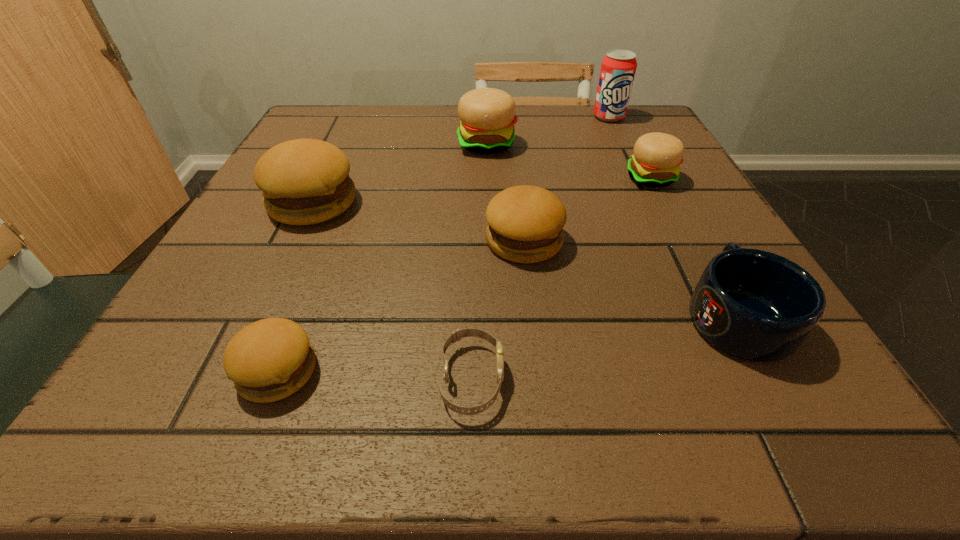
Where is `vacant space situated on the right of the shortest hamburger`? vacant space situated on the right of the shortest hamburger is located at coordinates (563, 371).

Where is `free space located on the face of the watch`? free space located on the face of the watch is located at coordinates (648, 380).

I want to click on soda can at the far edge, so click(618, 68).

I want to click on hamburger located at the far edge, so click(487, 115).

Find the location of `mug that is at the near edge`. mug that is at the near edge is located at coordinates (755, 305).

What are the coordinates of `hamburger that is at the near edge` in the screenshot? It's located at (268, 360).

Where is `watch present at the near edge`? The image size is (960, 540). watch present at the near edge is located at coordinates (469, 332).

The height and width of the screenshot is (540, 960). Find the location of `soda can positioned at the right edge`. soda can positioned at the right edge is located at coordinates pos(618,68).

I want to click on hamburger located in the right edge section of the desktop, so click(656, 161).

At what (x,y) coordinates should I click in order to perform the action: click on mug located in the right edge section of the desktop. Please return your answer as a coordinate pair (x, y). The image size is (960, 540). Looking at the image, I should click on (755, 305).